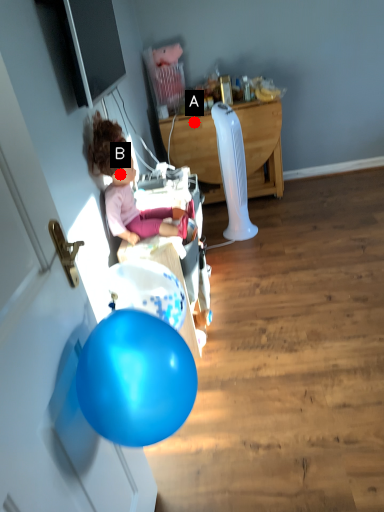
Question: Two points are circled on the image, labeled by A and B beside each circle. Which point is farther from the camera taking this photo?

Choices:
 (A) A is further
 (B) B is further

Answer: (A)